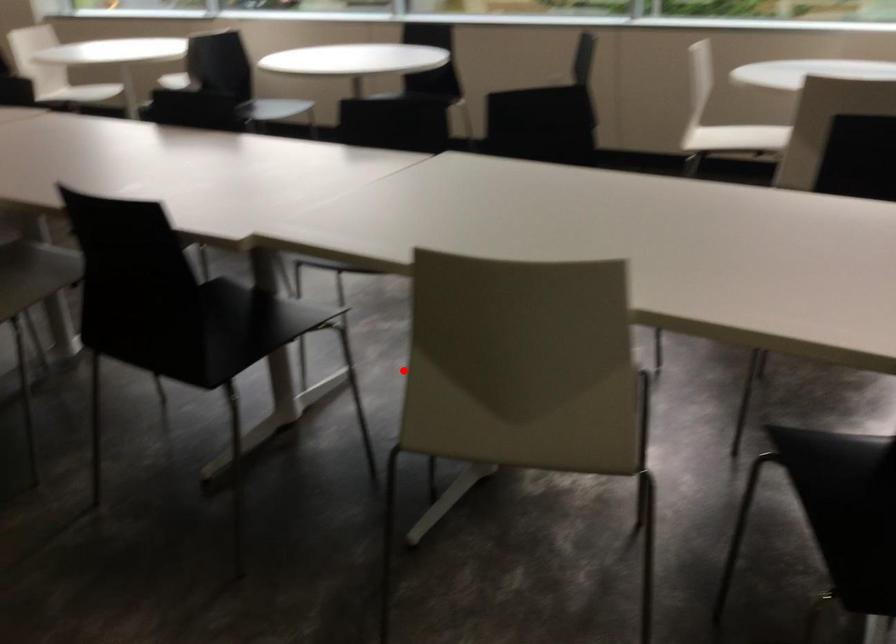
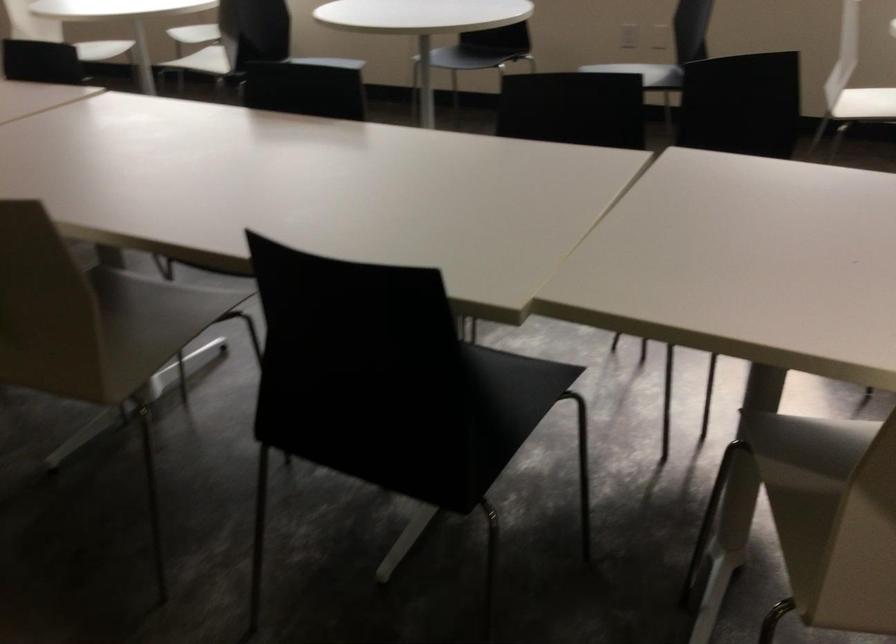
Question: I am providing you with two images of the same scene from different viewpoints. Image1 has a red point marked. In image2, the corresponding 3D location appears at what relative position? Reply with the corresponding letter.

Choices:
 (A) Closer
 (B) Farther

Answer: (A)